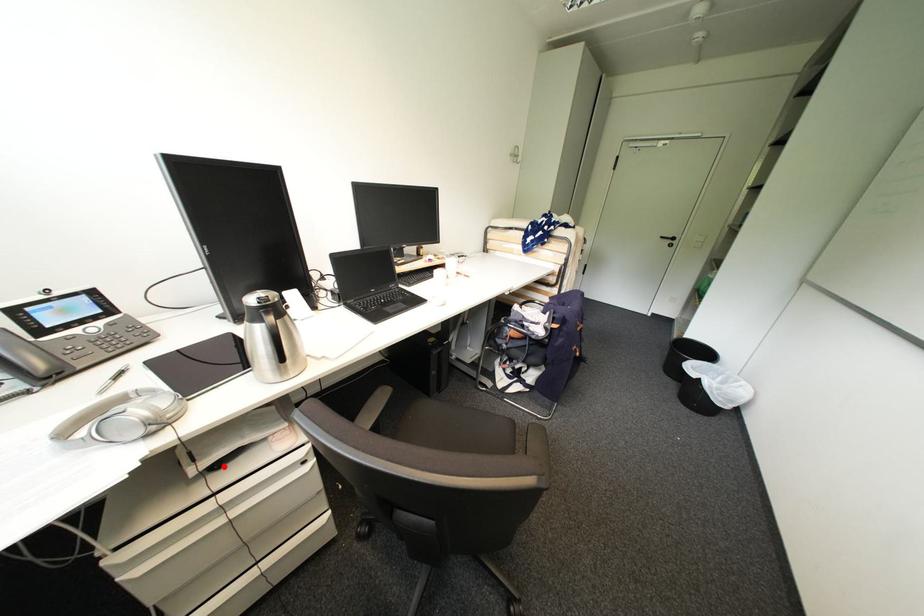
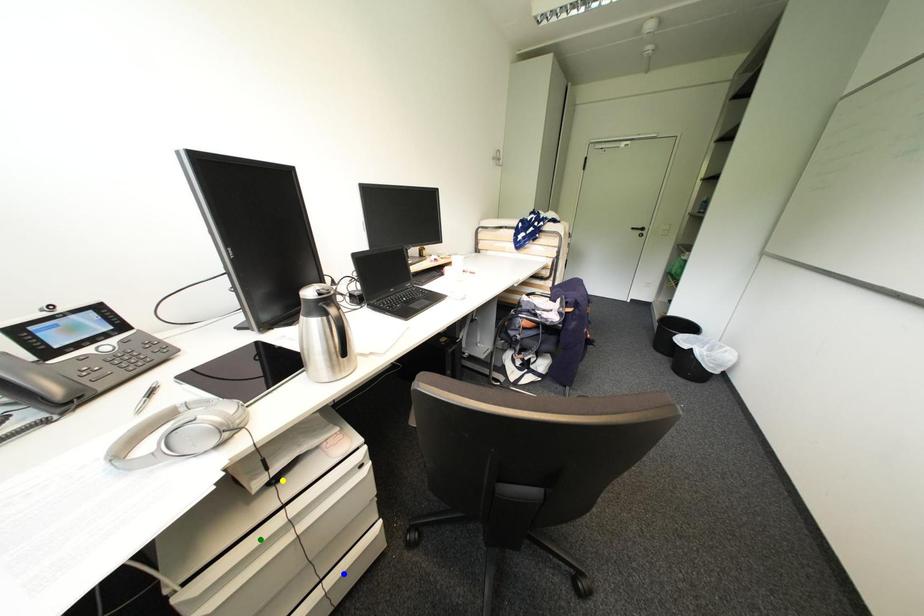
Question: I am providing you with two images of the same scene from different viewpoints. A red point is marked on the first image. You are given multiple points on the second image. Which point in image 2 is actually the same real-world point as the red point in image 1?

Choices:
 (A) blue point
 (B) yellow point
 (C) green point

Answer: (B)